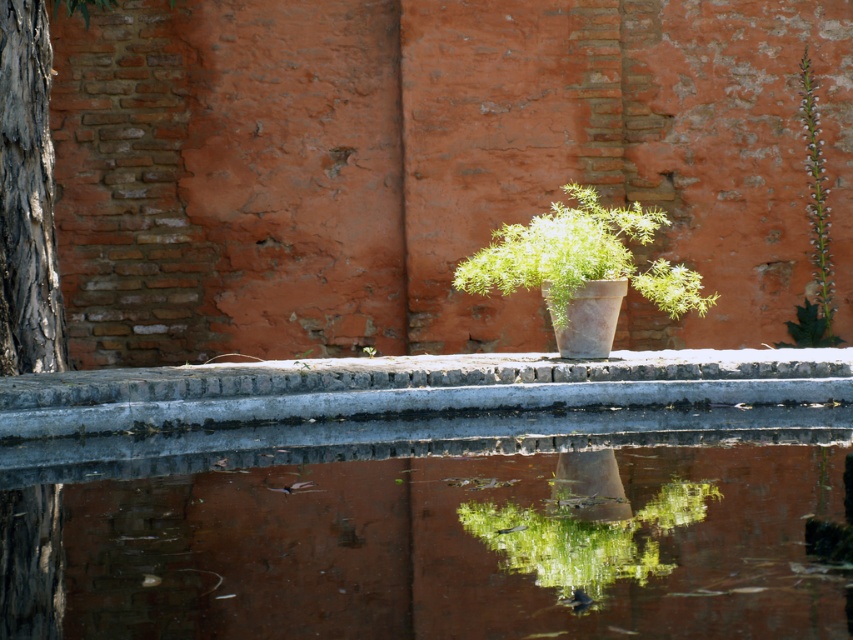
Between smooth concrete water at center and green matte plant at center, which one is positioned lower?

smooth concrete water at center

Which of these two, smooth concrete water at center or green matte plant at center, stands shorter?

Standing shorter between the two is smooth concrete water at center.

The height and width of the screenshot is (640, 853). Find the location of `smooth concrete water at center`. smooth concrete water at center is located at coordinates (433, 528).

This screenshot has width=853, height=640. I want to click on smooth concrete water at center, so click(433, 528).

This screenshot has width=853, height=640. Find the location of `gray bark tree trunk at left`. gray bark tree trunk at left is located at coordinates click(27, 196).

Find the location of a particular element. The height and width of the screenshot is (640, 853). gray bark tree trunk at left is located at coordinates pos(27,196).

Between gray bark tree trunk at left and green matte plant at center, which one is positioned higher?

gray bark tree trunk at left

Who is more forward, (x=47, y=211) or (x=554, y=220)?

Positioned in front is point (x=554, y=220).

The height and width of the screenshot is (640, 853). Find the location of `gray bark tree trunk at left`. gray bark tree trunk at left is located at coordinates (27, 196).